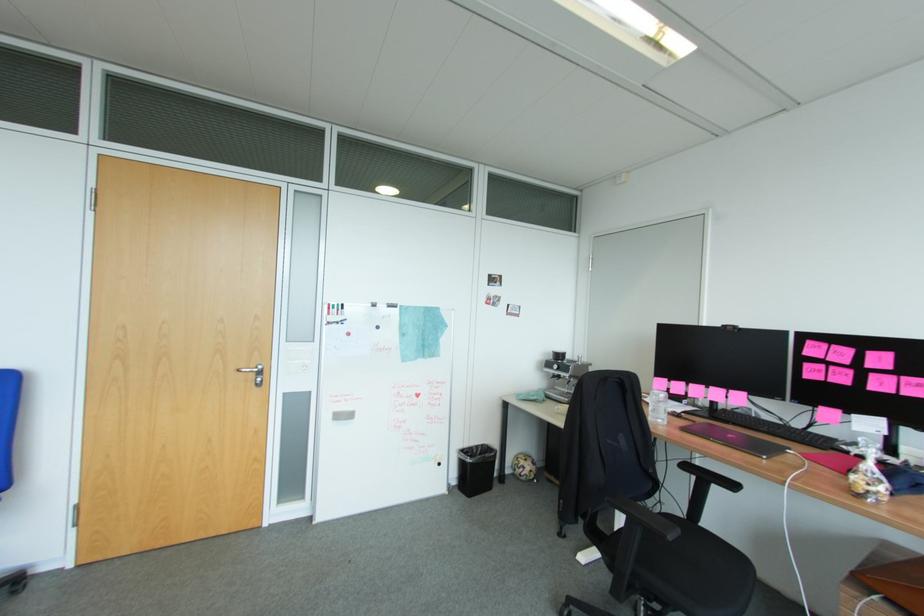
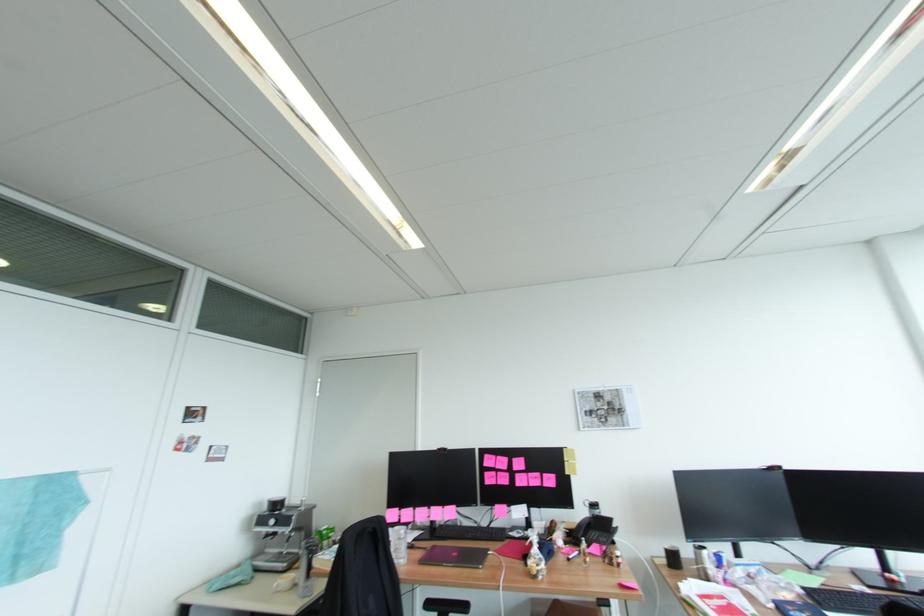
In the second image, find the point that corresponds to (x=815, y=342) in the first image.

(492, 456)